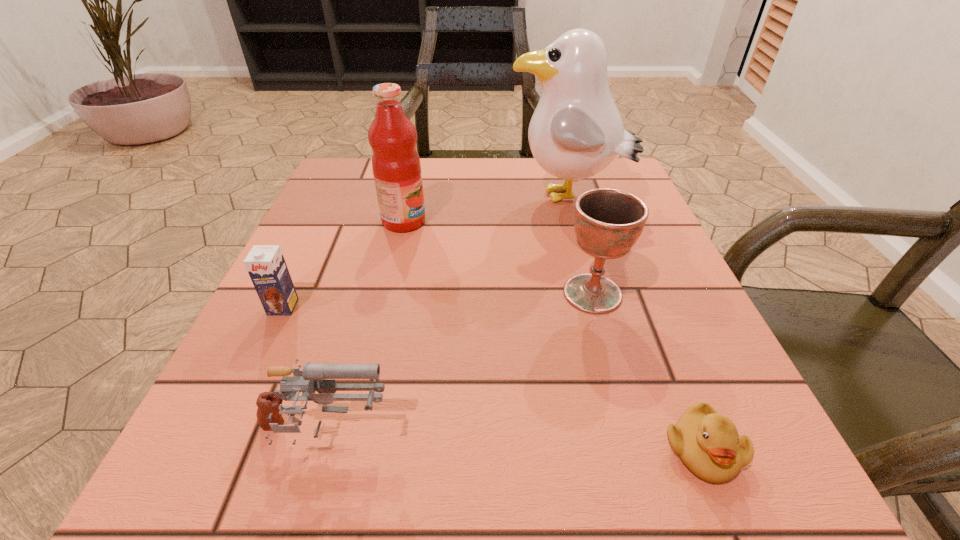
Identify the location of blank space located on the left of the third tallest object. (532, 293).

Where is `vacant space located 0.160m on the front label of the chocolate milk`? Image resolution: width=960 pixels, height=540 pixels. vacant space located 0.160m on the front label of the chocolate milk is located at coordinates (238, 401).

Where is `free space located at the barrel end of the gun`? free space located at the barrel end of the gun is located at coordinates (650, 434).

At what (x,y) coordinates should I click in order to perform the action: click on gull present at the far edge. Please return your answer as a coordinate pair (x, y). This screenshot has height=540, width=960. Looking at the image, I should click on (576, 131).

At what (x,y) coordinates should I click in order to perform the action: click on fruit juice located at the far edge. Please return your answer as a coordinate pair (x, y). Looking at the image, I should click on (396, 166).

You are a GUI agent. You are given a task and a screenshot of the screen. Output one action in this format:
    pyautogui.click(x=<x>, y=<y>)
    Task: Click on the gun that is at the near edge
    
    Given the screenshot: What is the action you would take?
    pyautogui.click(x=269, y=413)

I want to click on duckling at the near edge, so click(708, 443).

The height and width of the screenshot is (540, 960). What are the coordinates of `fruit juice positioned at the left edge` in the screenshot? It's located at (396, 166).

Locate an element on the screen. Image resolution: width=960 pixels, height=540 pixels. chocolate milk situated at the left edge is located at coordinates (266, 265).

This screenshot has height=540, width=960. I want to click on gun positioned at the left edge, so click(x=269, y=413).